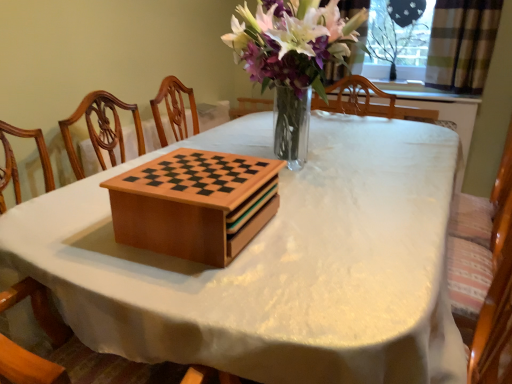
Question: Considering the relative sizes of wooden chessboard at center and plaid fabric curtain at upper right in the image provided, is wooden chessboard at center bigger than plaid fabric curtain at upper right?

Choices:
 (A) no
 (B) yes

Answer: (A)

Question: Considering the relative positions of wooden chessboard at center and plaid fabric curtain at upper right in the image provided, is wooden chessboard at center to the left of plaid fabric curtain at upper right from the viewer's perspective?

Choices:
 (A) no
 (B) yes

Answer: (B)

Question: Is wooden chessboard at center not inside plaid fabric curtain at upper right?

Choices:
 (A) yes
 (B) no

Answer: (A)

Question: From a real-world perspective, is wooden chessboard at center located beneath plaid fabric curtain at upper right?

Choices:
 (A) no
 (B) yes

Answer: (B)

Question: Considering the relative positions of wooden chessboard at center and plaid fabric curtain at upper right in the image provided, is wooden chessboard at center in front of plaid fabric curtain at upper right?

Choices:
 (A) no
 (B) yes

Answer: (B)

Question: Based on their sizes in the image, would you say wooden chessboard at center is bigger or smaller than plaid fabric curtain at upper right?

Choices:
 (A) big
 (B) small

Answer: (B)

Question: In the image, is wooden chessboard at center on the left side or the right side of plaid fabric curtain at upper right?

Choices:
 (A) left
 (B) right

Answer: (A)

Question: Do you think wooden chessboard at center is within plaid fabric curtain at upper right, or outside of it?

Choices:
 (A) outside
 (B) inside

Answer: (A)

Question: Is wooden chessboard at center in front of or behind plaid fabric curtain at upper right in the image?

Choices:
 (A) behind
 (B) front

Answer: (B)

Question: Do you think plaid fabric curtain at upper right is within wooden chessboard at center, or outside of it?

Choices:
 (A) outside
 (B) inside

Answer: (A)

Question: Considering their positions, is plaid fabric curtain at upper right located in front of or behind wooden chessboard at center?

Choices:
 (A) front
 (B) behind

Answer: (B)

Question: Is plaid fabric curtain at upper right bigger or smaller than wooden chessboard at center?

Choices:
 (A) small
 (B) big

Answer: (B)

Question: From the image's perspective, is plaid fabric curtain at upper right located above or below wooden chessboard at center?

Choices:
 (A) above
 (B) below

Answer: (A)

Question: From the image's perspective, is wooden chess set at center positioned above or below transparent plastic screen at upper right?

Choices:
 (A) above
 (B) below

Answer: (B)

Question: Considering their positions, is wooden chess set at center located in front of or behind transparent plastic screen at upper right?

Choices:
 (A) behind
 (B) front

Answer: (B)